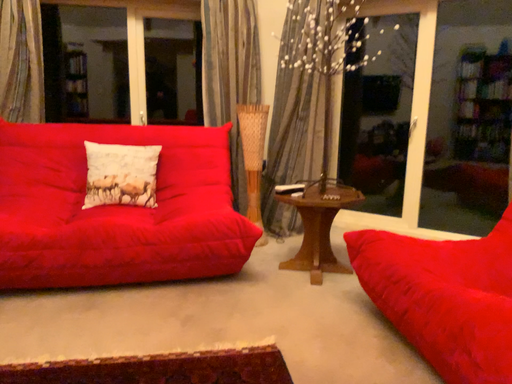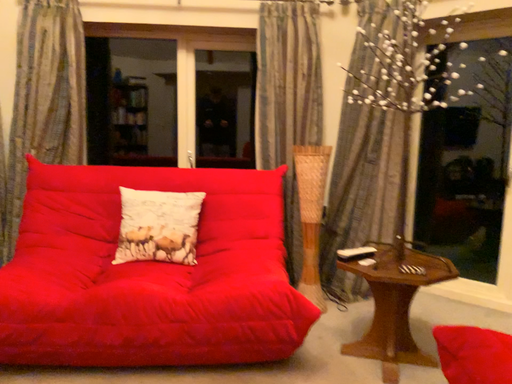
Question: How did the camera likely rotate when shooting the video?

Choices:
 (A) rotated right
 (B) rotated left

Answer: (B)